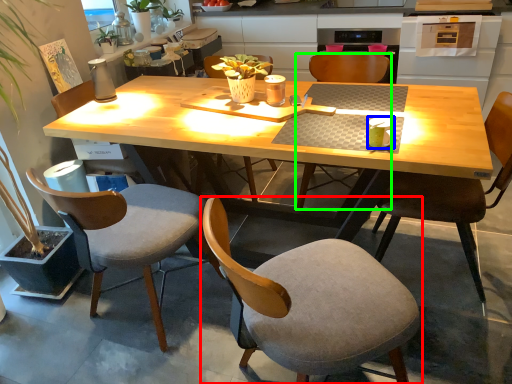
Question: Based on their relative distances, which object is nearer to chair (highlighted by a red box)? Choose from coffee cup (highlighted by a blue box) and chair (highlighted by a green box).

Choices:
 (A) coffee cup
 (B) chair

Answer: (A)